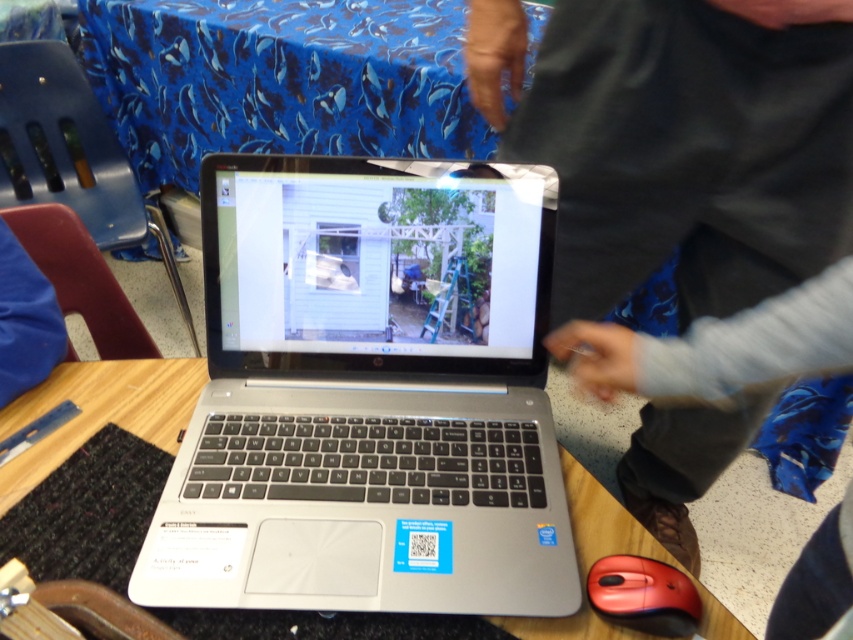
Question: Based on their relative distances, which object is nearer to the blue fabric tablecloth at upper center?

Choices:
 (A) wooden table at center
 (B) rubberized red mouse at lower right
 (C) gray fabric at upper center
 (D) silver metallic laptop at center

Answer: (D)

Question: Is blue fabric tablecloth at upper center closer to the viewer compared to gray fabric at upper center?

Choices:
 (A) yes
 (B) no

Answer: (B)

Question: Which point is farther to the camera?

Choices:
 (A) rubberized red mouse at lower right
 (B) gray fabric at upper center
 (C) blue fabric tablecloth at upper center

Answer: (C)

Question: Which point is farther from the camera taking this photo?

Choices:
 (A) (154, 435)
 (B) (537, 593)

Answer: (A)

Question: Can you confirm if silver metallic laptop at center is positioned above blue fabric tablecloth at upper center?

Choices:
 (A) no
 (B) yes

Answer: (A)

Question: Is silver metallic laptop at center smaller than wooden table at center?

Choices:
 (A) no
 (B) yes

Answer: (A)